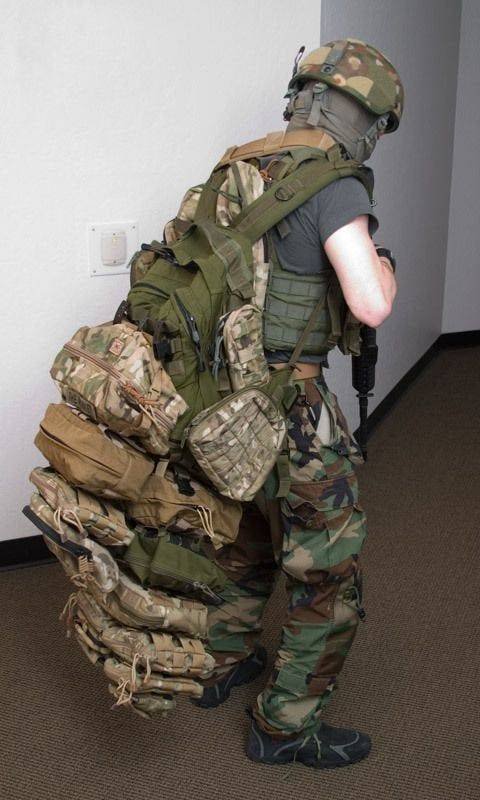
Where is `floor`? Image resolution: width=480 pixels, height=800 pixels. floor is located at coordinates (433, 490), (432, 554), (31, 712).